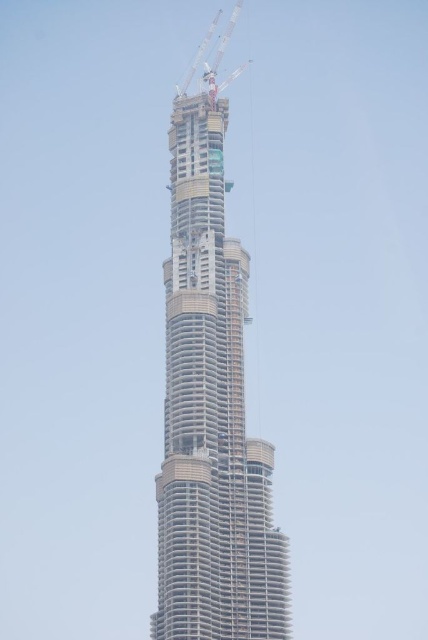
Question: Which point appears farthest from the camera in this image?

Choices:
 (A) 192,285
 (B) 186,93

Answer: (B)

Question: Is beige concrete tower at center to the left of white metallic crane at upper center from the viewer's perspective?

Choices:
 (A) yes
 (B) no

Answer: (A)

Question: Is beige concrete tower at center to the left of white metallic crane at upper center from the viewer's perspective?

Choices:
 (A) no
 (B) yes

Answer: (B)

Question: Can you confirm if beige concrete tower at center is positioned below white metallic crane at upper center?

Choices:
 (A) no
 (B) yes

Answer: (B)